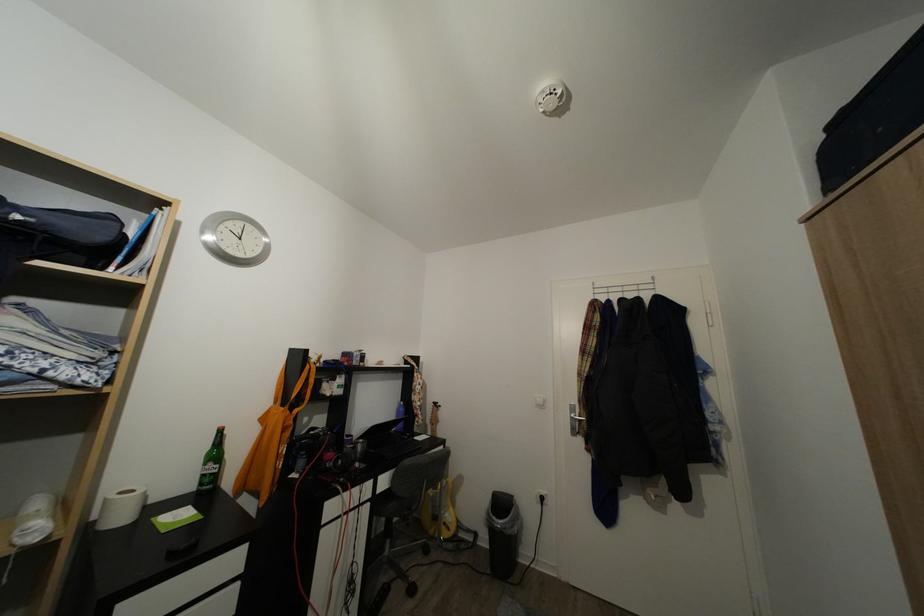
The width and height of the screenshot is (924, 616). I want to click on smoke detector button, so click(x=552, y=103).